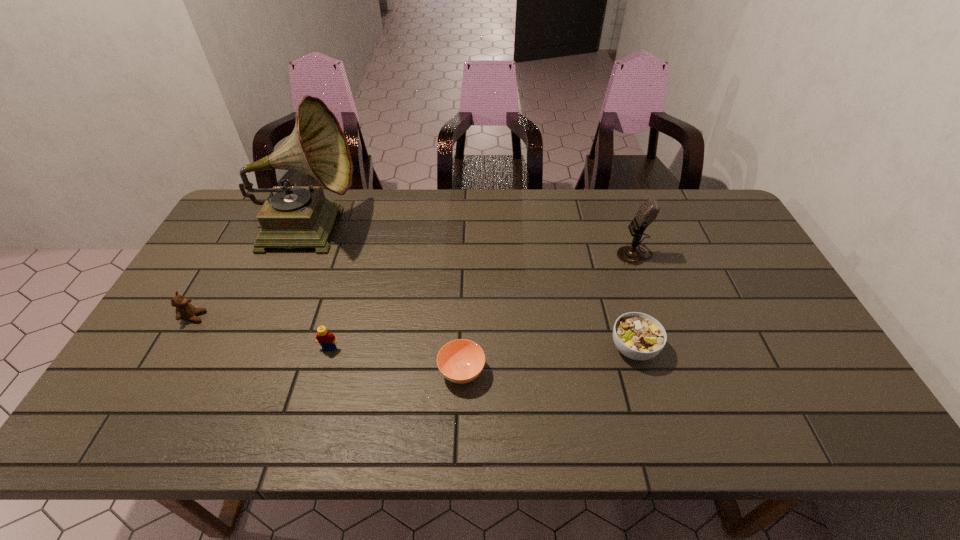
Where is `the fourth closest object relative to the teddy bear`? The image size is (960, 540). the fourth closest object relative to the teddy bear is located at coordinates (638, 336).

I want to click on vacant space that satisfies the following two spatial constraints: 1. from the horn of the record player; 2. on the back side of the fifth tallest object, so click(259, 348).

Locate an element on the screen. This screenshot has width=960, height=540. free region that satisfies the following two spatial constraints: 1. on the front-facing side of the Lego; 2. on the left side of the second shortest object is located at coordinates (329, 348).

Locate an element on the screen. The height and width of the screenshot is (540, 960). vacant point that satisfies the following two spatial constraints: 1. at the face of the leftmost object; 2. on the back side of the fourth object from left to right is located at coordinates (162, 372).

This screenshot has height=540, width=960. Find the location of `blank space that satisfies the following two spatial constraints: 1. at the face of the teddy bear; 2. on the right side of the left soup bowl`. blank space that satisfies the following two spatial constraints: 1. at the face of the teddy bear; 2. on the right side of the left soup bowl is located at coordinates (162, 372).

Where is `free space that satisfies the following two spatial constraints: 1. from the horn of the left soup bowl; 2. on the right side of the record player`? Image resolution: width=960 pixels, height=540 pixels. free space that satisfies the following two spatial constraints: 1. from the horn of the left soup bowl; 2. on the right side of the record player is located at coordinates (250, 372).